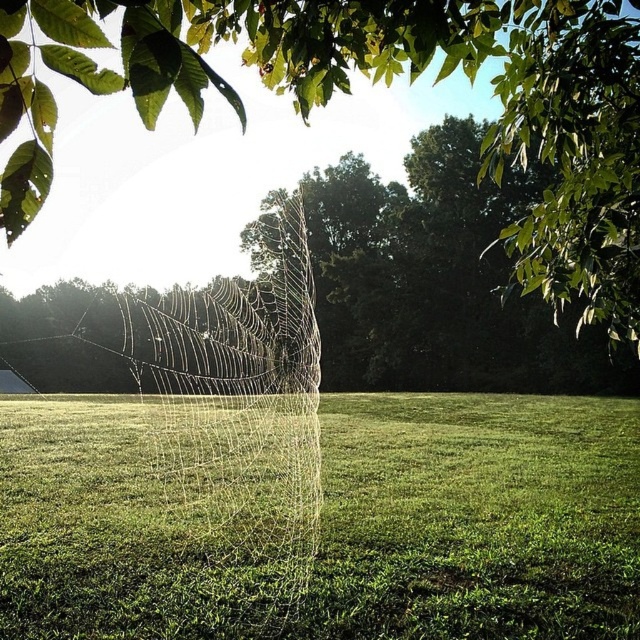
Does point (316, 225) come behind point (10, 340)?

Yes, point (316, 225) is farther from viewer.

Can you confirm if green leafy tree at center is positioned to the right of transparent silk web at center?

Yes, green leafy tree at center is to the right of transparent silk web at center.

This screenshot has height=640, width=640. In order to click on green leafy tree at center in this screenshot , I will do `click(461, 184)`.

Where is `green leafy tree at center`? green leafy tree at center is located at coordinates (461, 184).

Consider the image. Is green grass at center bigger than transparent silk spider web at center?

No, green grass at center is not bigger than transparent silk spider web at center.

Can you confirm if green grass at center is thinner than transparent silk spider web at center?

Indeed, green grass at center has a lesser width compared to transparent silk spider web at center.

Does point (339, 497) lie behind point (195, 472)?

No, (339, 497) is in front of (195, 472).

Identify the location of green grass at center. This screenshot has width=640, height=640. (476, 518).

Can you confirm if green grass at center is smaller than transparent silk web at center?

Correct, green grass at center occupies less space than transparent silk web at center.

Which is behind, point (609, 412) or point (208, 296)?

Positioned behind is point (208, 296).

Where is `green grass at center`? This screenshot has width=640, height=640. green grass at center is located at coordinates (476, 518).